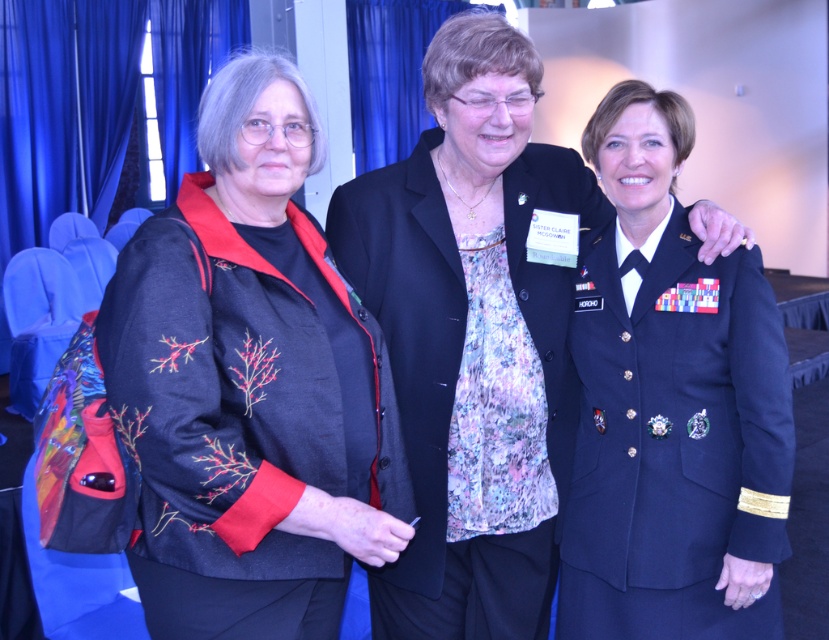
You are a fashion designer observing the two central women in the image. The first woman wears an embroidered fabric jacket at center, and the second wears a navy blue fabric military uniform at center. Which of these two garments appears bigger in size?

The embroidered fabric jacket at center has a larger size compared to the navy blue fabric military uniform at center, so the embroidered fabric jacket at center appears bigger in size.

You are a photographer positioned in front of the three women. You need to focus your camera lens on the embroidered fabric jacket at center and the navy blue fabric military uniform at right. Which of the two items will require you to adjust the focus to a closer distance?

The embroidered fabric jacket at center is closer to the viewer than the navy blue fabric military uniform at right, so you should adjust the focus to a closer distance for the embroidered fabric jacket at center.

You are a photographer setting up for a group photo in a conference room. You need to position two subjects wearing an embroidered fabric jacket at center and a navy blue fabric military uniform at center. Based on the scene description, which subject should stand to the right side when arranging them side by side?

The embroidered fabric jacket at center should be positioned to the left of the navy blue fabric military uniform at center, so the navy blue fabric military uniform at center should be placed on the right side.